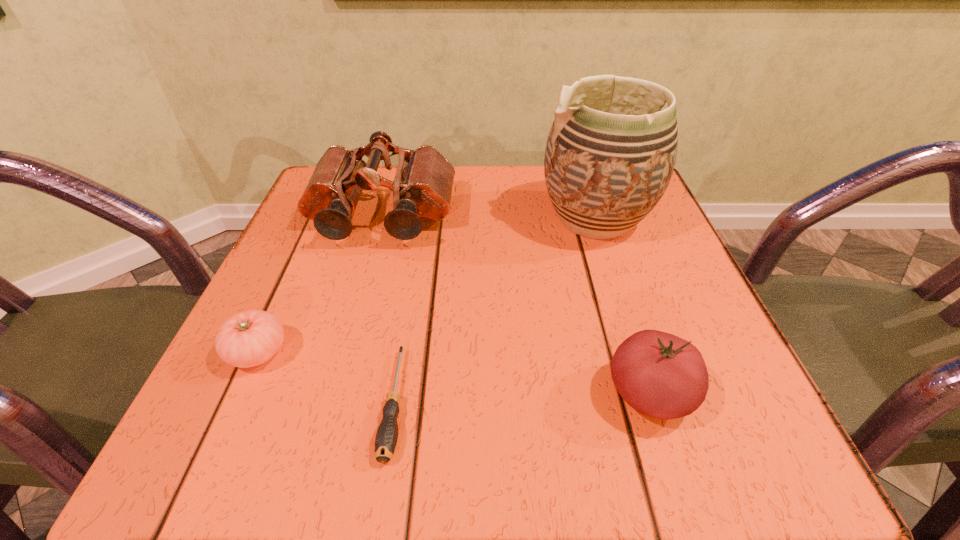
Image resolution: width=960 pixels, height=540 pixels. I want to click on vacant area that satisfies the following two spatial constraints: 1. on the front side of the second shortest object; 2. on the right side of the third tallest object, so click(239, 394).

Locate an element on the screen. The height and width of the screenshot is (540, 960). free spot that satisfies the following two spatial constraints: 1. on the back side of the screwdriver; 2. on the left side of the pottery is located at coordinates (423, 218).

At what (x,y) coordinates should I click in order to perform the action: click on vacant space that satisfies the following two spatial constraints: 1. through the eyepieces of the pottery; 2. on the right side of the binoculars. Please return your answer as a coordinate pair (x, y). This screenshot has height=540, width=960. Looking at the image, I should click on (382, 218).

Find the location of a particular element. Image resolution: width=960 pixels, height=540 pixels. vacant space that satisfies the following two spatial constraints: 1. through the eyepieces of the fourth shortest object; 2. on the left side of the third tallest object is located at coordinates (333, 394).